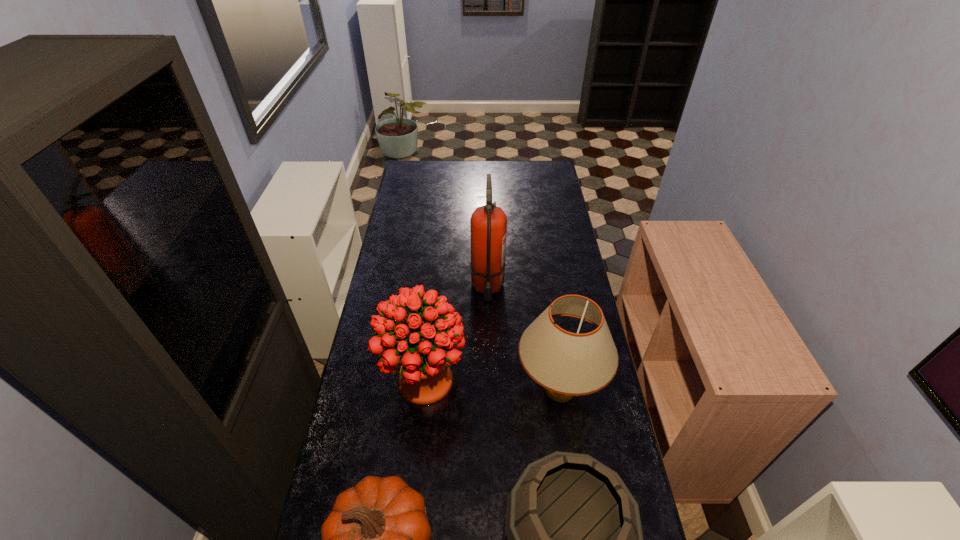
Identify the location of fire extinguisher. coord(488,225).

The image size is (960, 540). What are the coordinates of `bouquet` in the screenshot? It's located at (420, 352).

Where is `lampshade`? The height and width of the screenshot is (540, 960). lampshade is located at coordinates (566, 364).

Image resolution: width=960 pixels, height=540 pixels. What are the coordinates of `free space located on the nozzle of the farthest object` in the screenshot? It's located at click(x=488, y=321).

What are the coordinates of `blank space located 0.090m on the left of the bouquet` in the screenshot? It's located at (356, 382).

Locate an element on the screen. This screenshot has height=540, width=960. vacant space located 0.190m on the back of the lampshade is located at coordinates click(548, 313).

Find the location of a particular element. This screenshot has width=960, height=540. object that is at the left edge is located at coordinates (420, 352).

At what (x,y) coordinates should I click in order to perform the action: click on object at the right edge. Please return your answer as a coordinate pair (x, y). The height and width of the screenshot is (540, 960). Looking at the image, I should click on (566, 364).

Where is `vacant space at the far edge`? This screenshot has width=960, height=540. vacant space at the far edge is located at coordinates (442, 170).

Locate an element on the screen. vacant space at the left edge of the desktop is located at coordinates (340, 465).